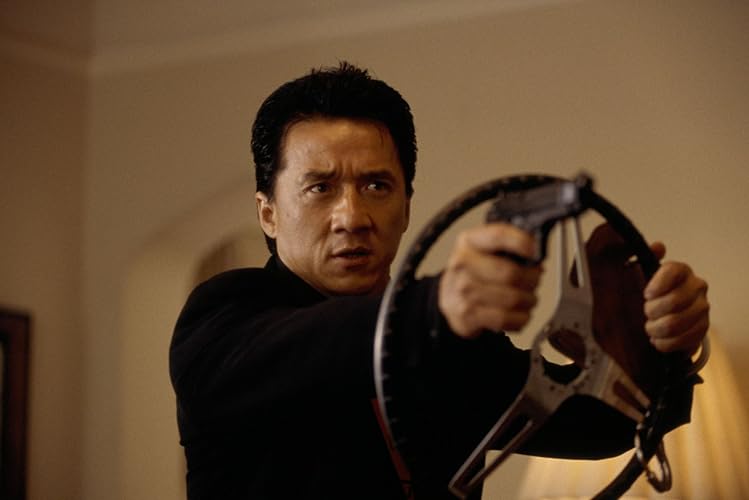
Where is `inside wall corner`? inside wall corner is located at coordinates (82, 160).